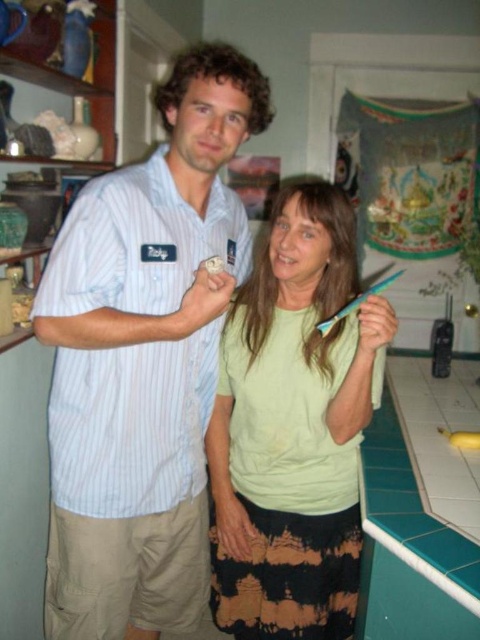
You are standing in the kitchen and need to reach the point marked at coordinates (153, 570). Your arm can extend 1.5 meters. Can you reach that point?

The point marked at coordinates (153, 570) is 1.46 meters away from the camera, so yes, you can reach it since your arm can extend 1.5 meters.

You are a painter who needs to paint the white striped shirt at center and the green tile countertop at lower right. Which object should you paint first if you want to start with the taller one?

The white striped shirt at center is much taller than the green tile countertop at lower right, so you should paint the white striped shirt at center first.

You are a photographer trying to capture a group photo of the white striped shirt at center and the green matte shirt at center. Which person should stand behind to ensure both are fully visible in the photo?

The white striped shirt at center is taller than the green matte shirt at center, so the photographer should have the green matte shirt at center stand behind the white striped shirt at center to ensure both are fully visible.